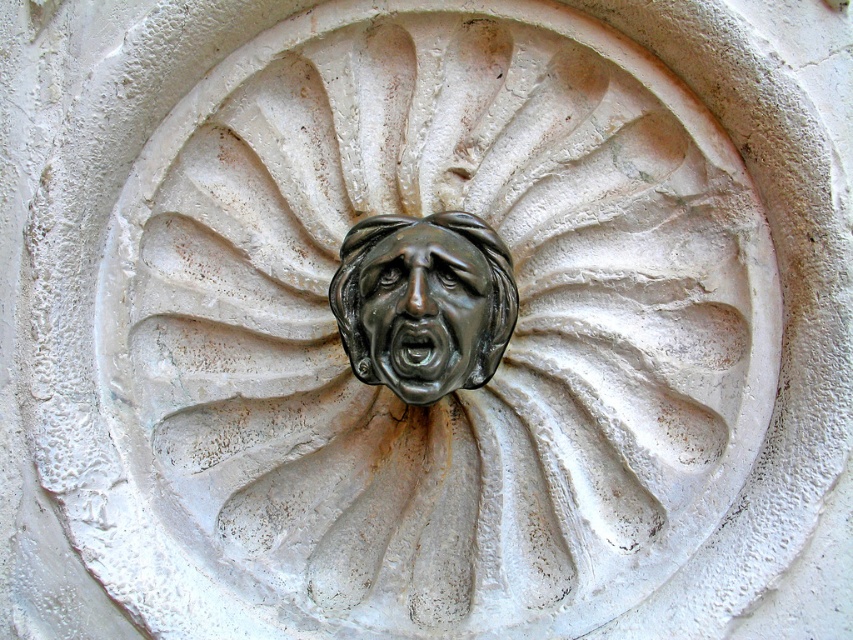
Is bronze/sculpted face at center to the left of shiny bronze face at center from the viewer's perspective?

Indeed, bronze/sculpted face at center is positioned on the left side of shiny bronze face at center.

Is bronze/sculpted face at center to the right of shiny bronze face at center from the viewer's perspective?

In fact, bronze/sculpted face at center is to the left of shiny bronze face at center.

Find the location of `bronze/sculpted face at center`. bronze/sculpted face at center is located at coordinates (424, 301).